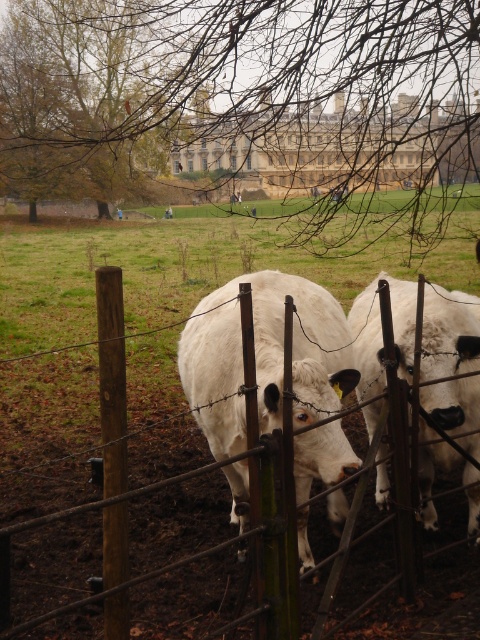
Question: Does brown leafy tree at upper left appear under brown wooden fence at center?

Choices:
 (A) no
 (B) yes

Answer: (A)

Question: Is brown leafy tree at upper left smaller than brown wooden fence at center?

Choices:
 (A) no
 (B) yes

Answer: (A)

Question: Which point is farther to the camera?

Choices:
 (A) (422, 68)
 (B) (242, 422)

Answer: (A)

Question: Which of the following is the closest to the observer?

Choices:
 (A) (402, 371)
 (B) (122, 17)
 (C) (15, 29)
 (D) (215, 467)

Answer: (D)

Question: Which object appears closest to the camera in this image?

Choices:
 (A) brown wooden fence at center
 (B) white woolly cow at center

Answer: (A)

Question: Is brown leafy tree at upper left closer to the viewer compared to white matte cow at center?

Choices:
 (A) yes
 (B) no

Answer: (B)